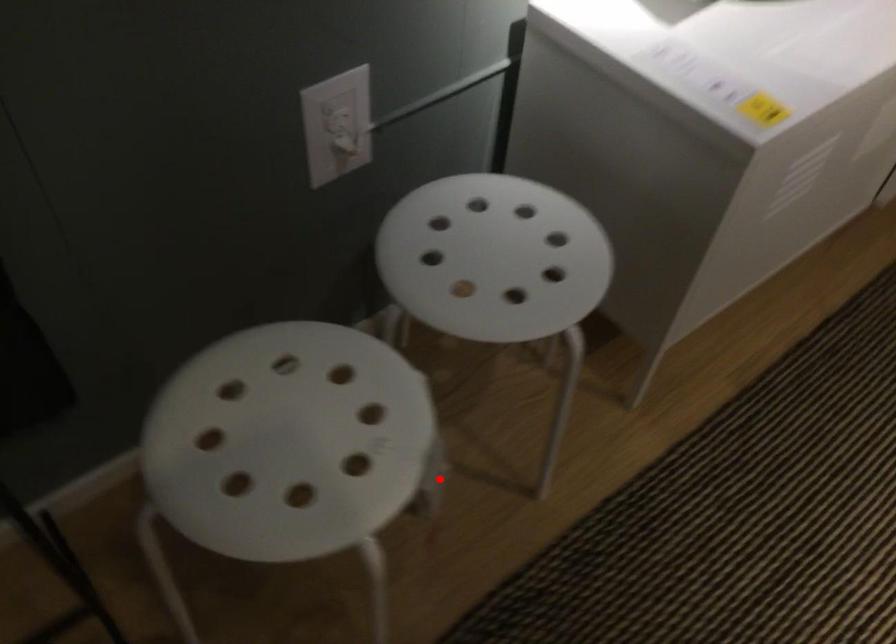
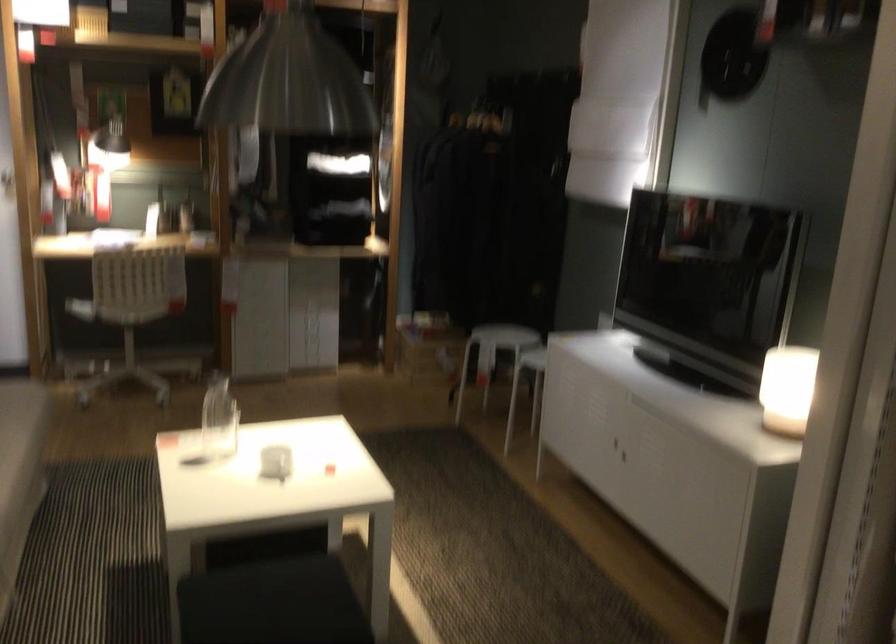
Question: I am providing you with two images of the same scene from different viewpoints. In image1, a red point is highlighted. Considering the same 3D point in image2, which of the following is correct?

Choices:
 (A) It is closer
 (B) It is farther

Answer: (B)